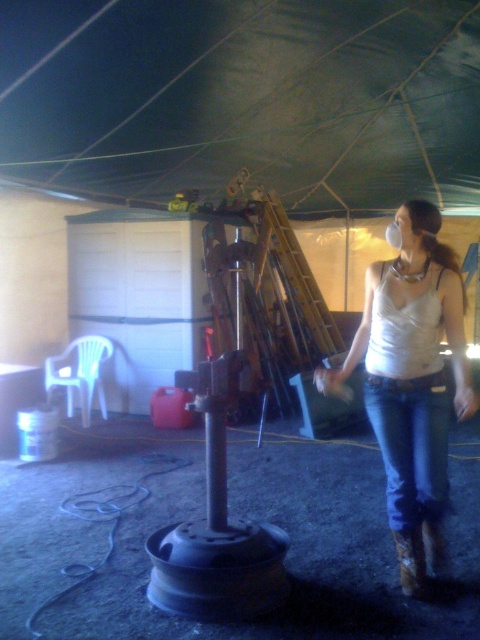
Does white matte tank top at center appear over brown suede cowboy boot at lower right?

Indeed, white matte tank top at center is positioned over brown suede cowboy boot at lower right.

Is point (396, 502) closer to viewer compared to point (411, 561)?

No.

The image size is (480, 640). I want to click on white matte tank top at center, so click(x=411, y=371).

Is denim at right taller than brown suede cowboy boot at lower right?

Correct, denim at right is much taller as brown suede cowboy boot at lower right.

Can you confirm if denim at right is smaller than brown suede cowboy boot at lower right?

No, denim at right is not smaller than brown suede cowboy boot at lower right.

Between point (443, 380) and point (414, 541), which one is positioned behind?

Point (414, 541)

You are a GUI agent. You are given a task and a screenshot of the screen. Output one action in this format:
    pyautogui.click(x=<x>, y=<y>)
    Task: Click on the denim at right
    Image resolution: width=480 pixels, height=640 pixels.
    Given the screenshot: What is the action you would take?
    pyautogui.click(x=411, y=445)

Which is more to the right, white matte tank top at center or denim at right?

denim at right

This screenshot has height=640, width=480. What are the coordinates of `white matte tank top at center` in the screenshot? It's located at (411, 371).